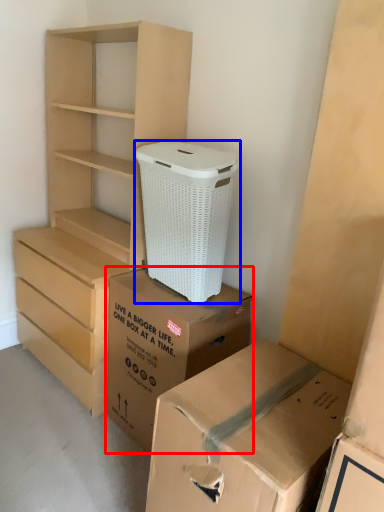
Question: Which object is closer to the camera taking this photo, box (highlighted by a red box) or shoe box (highlighted by a blue box)?

Choices:
 (A) box
 (B) shoe box

Answer: (B)